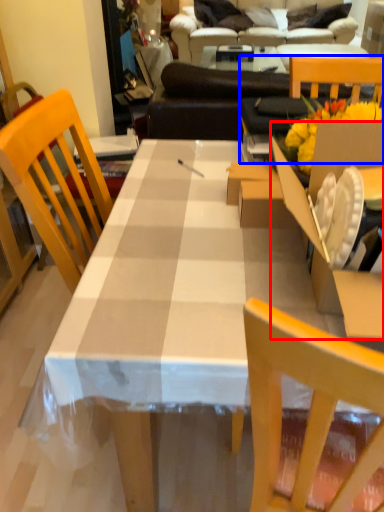
Question: Which point is closer to the camera, cardboard box (highlighted by a red box) or chair (highlighted by a blue box)?

Choices:
 (A) cardboard box
 (B) chair

Answer: (A)